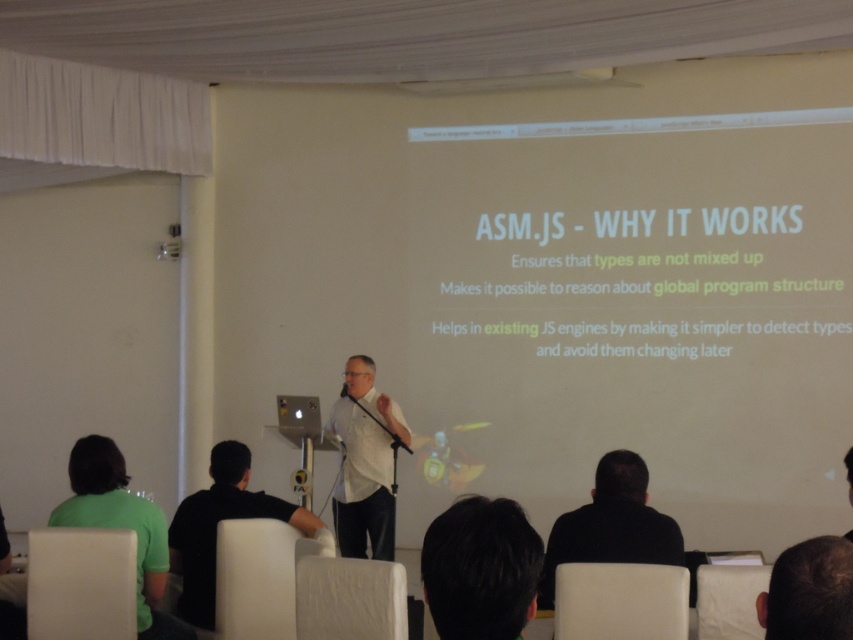
You are an event planner organizing a conference and need to ensure that all speakers are visible to the audience. You notice the white matte shirt at center and the dark brown hair at lower right in the image. Based on their positions and sizes, which object would likely be more visible to the audience from the back of the room?

The white matte shirt at center is likely more visible to the audience from the back of the room because it might be wider than the dark brown hair at lower right.

You are a photographer adjusting lighting for a presentation. You need to ensure that the black hair at lower center and the metallic silver microphone at center are both well lit. Which object should you adjust the lighting for first if you want to cover the wider area?

The black hair at lower center should be lit first because its width is greater than the metallic silver microphone at center, meaning it requires a wider coverage area.